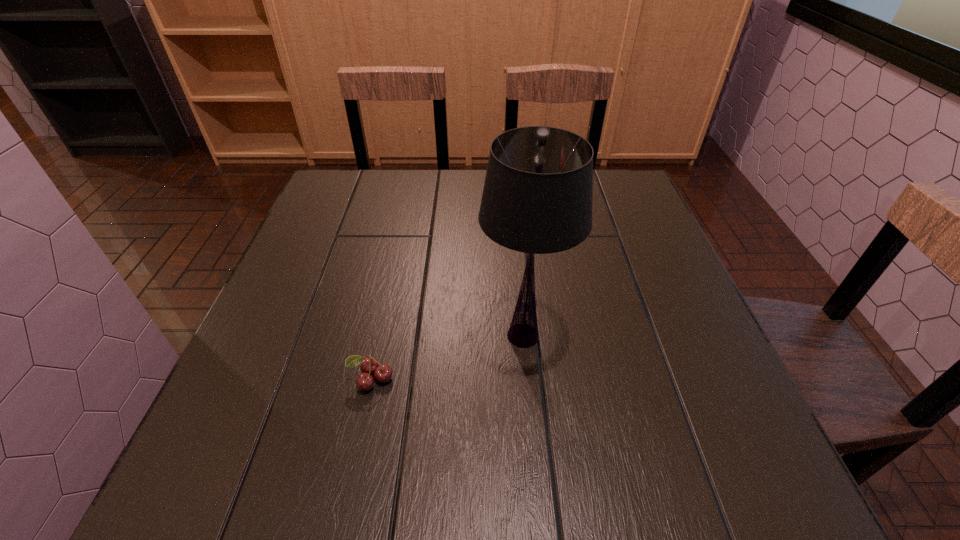
In the image, there is a desktop. Identify the location of free space at the left edge. The image size is (960, 540). (329, 233).

Where is `vacant region at the right edge of the desktop`? vacant region at the right edge of the desktop is located at coordinates (648, 266).

Find the location of `free region at the far left corner`. free region at the far left corner is located at coordinates (375, 174).

The image size is (960, 540). I want to click on free space at the near left corner of the desktop, so click(x=194, y=482).

Image resolution: width=960 pixels, height=540 pixels. I want to click on vacant space at the near right corner of the desktop, so click(702, 469).

What are the coordinates of `empty space between the lampshade and the shorter object` in the screenshot? It's located at (447, 357).

Locate an element on the screen. Image resolution: width=960 pixels, height=540 pixels. free spot between the left object and the right object is located at coordinates (447, 357).

Identify the location of vacant region between the shorter object and the taller object. (447, 357).

At what (x,y) coordinates should I click in order to perform the action: click on vacant region that satisfies the following two spatial constraints: 1. on the front-facing side of the lampshade; 2. on the leaves of the shorter object. Please return your answer as a coordinate pair (x, y). Looking at the image, I should click on (527, 379).

At what (x,y) coordinates should I click in order to perform the action: click on vacant point that satisfies the following two spatial constraints: 1. on the front-facing side of the taller object; 2. on the leaves of the left object. Please return your answer as a coordinate pair (x, y). The width and height of the screenshot is (960, 540). Looking at the image, I should click on (527, 379).